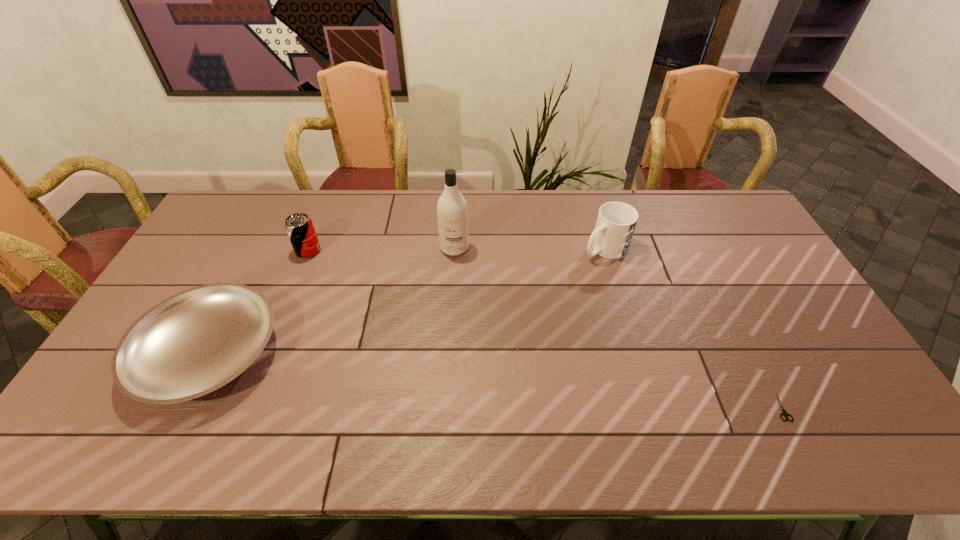
Where is `free location located on the right of the bedpan`? free location located on the right of the bedpan is located at coordinates (387, 353).

Find the location of a particular element. This screenshot has width=960, height=540. free space located 0.360m on the left of the shortest object is located at coordinates (628, 406).

You are a GUI agent. You are given a task and a screenshot of the screen. Output one action in this format:
    pyautogui.click(x=<x>, y=<y>)
    Task: Click on the bedpan at the near edge
    The width and height of the screenshot is (960, 540).
    Given the screenshot: What is the action you would take?
    pyautogui.click(x=193, y=343)

Where is `shears that is at the near edge`? shears that is at the near edge is located at coordinates (784, 412).

Where is `object that is at the left edge`? Image resolution: width=960 pixels, height=540 pixels. object that is at the left edge is located at coordinates (193, 343).

Identify the location of object at the near left corner. Image resolution: width=960 pixels, height=540 pixels. coord(193,343).

Identify the location of free location at the far edge of the desktop. This screenshot has width=960, height=540. (670, 221).

In the image, there is a desktop. Identify the location of free space at the left edge. The image size is (960, 540). (233, 246).

The height and width of the screenshot is (540, 960). What are the coordinates of `free spot at the right edge of the desktop` in the screenshot? It's located at (808, 394).

Identify the location of vacant area at the far right corner of the desktop. Image resolution: width=960 pixels, height=540 pixels. (710, 193).